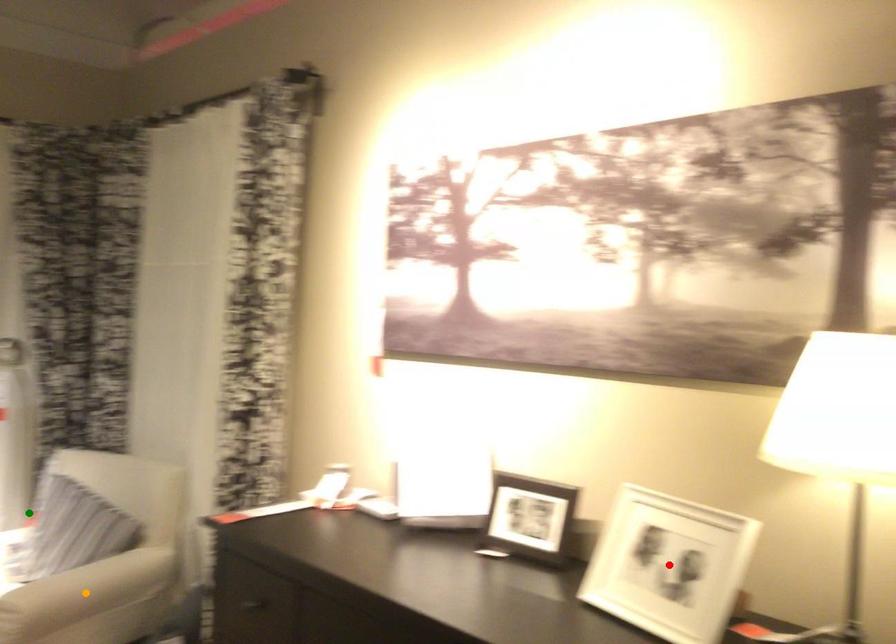
Order these from nearest to farthest:
red point
green point
orange point

red point → orange point → green point